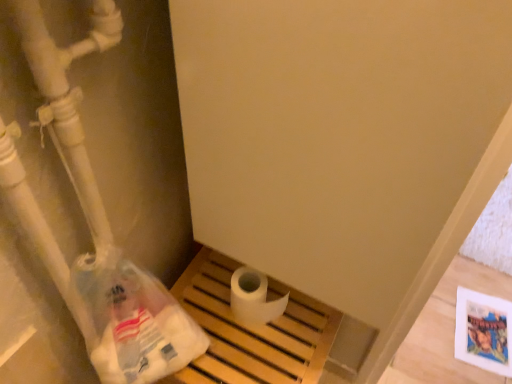
I want to click on free space on the front side of white matte toilet paper at center, so click(256, 350).